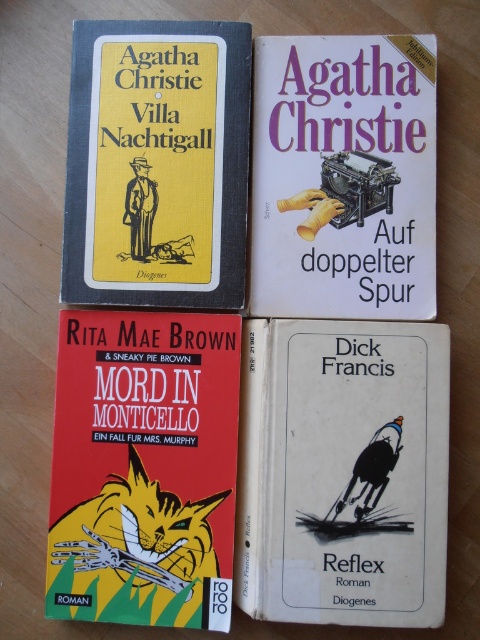
Question: Which of the following is the farthest from the observer?

Choices:
 (A) (213, 324)
 (B) (242, 257)
 (C) (262, 164)
 (D) (287, 579)

Answer: (A)

Question: Does white matte book at bottom right appear on the left side of yellow matte book cover at upper left?

Choices:
 (A) yes
 (B) no

Answer: (B)

Question: Which of these objects is positioned closest to the red matte book cover at bottom left?

Choices:
 (A) yellow matte book cover at upper left
 (B) white paper book at upper center

Answer: (A)

Question: Considering the real-world distances, which object is closest to the yellow matte book cover at upper left?

Choices:
 (A) white matte book at bottom right
 (B) white paper book at upper center

Answer: (B)

Question: Does white matte book at bottom right appear over red matte book cover at bottom left?

Choices:
 (A) yes
 (B) no

Answer: (B)

Question: Does red matte book cover at bottom left have a larger size compared to white paper book at upper center?

Choices:
 (A) yes
 (B) no

Answer: (A)